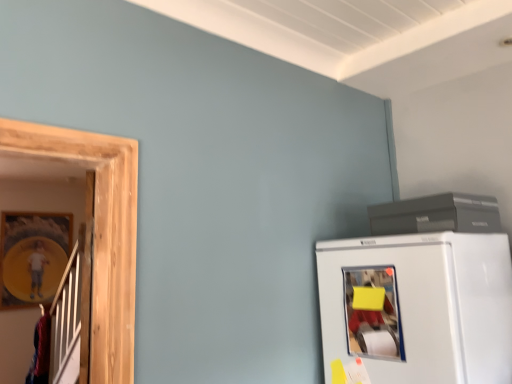
Question: Does white matte refrigerator at lower right have a lesser width compared to yellow matte paper at lower right?

Choices:
 (A) no
 (B) yes

Answer: (A)

Question: Considering the relative sizes of white matte refrigerator at lower right and yellow matte paper at lower right in the image provided, is white matte refrigerator at lower right shorter than yellow matte paper at lower right?

Choices:
 (A) no
 (B) yes

Answer: (A)

Question: From a real-world perspective, is white matte refrigerator at lower right under yellow matte paper at lower right?

Choices:
 (A) yes
 (B) no

Answer: (A)

Question: Can you confirm if white matte refrigerator at lower right is taller than yellow matte paper at lower right?

Choices:
 (A) yes
 (B) no

Answer: (A)

Question: Is white matte refrigerator at lower right aimed at yellow matte paper at lower right?

Choices:
 (A) yes
 (B) no

Answer: (A)

Question: Is point (373, 261) closer or farther from the camera than point (66, 213)?

Choices:
 (A) farther
 (B) closer

Answer: (B)

Question: Is white matte refrigerator at lower right inside or outside of wooden framed picture at left?

Choices:
 (A) inside
 (B) outside

Answer: (B)

Question: From a real-world perspective, is white matte refrigerator at lower right above or below wooden framed picture at left?

Choices:
 (A) above
 (B) below

Answer: (B)

Question: Is white matte refrigerator at lower right in front of or behind wooden framed picture at left in the image?

Choices:
 (A) front
 (B) behind

Answer: (A)

Question: Is white matte refrigerator at lower right situated inside matte gray printer at upper right or outside?

Choices:
 (A) outside
 (B) inside

Answer: (A)

Question: Considering the relative positions of white matte refrigerator at lower right and matte gray printer at upper right in the image provided, is white matte refrigerator at lower right to the left or to the right of matte gray printer at upper right?

Choices:
 (A) right
 (B) left

Answer: (B)

Question: Is white matte refrigerator at lower right taller or shorter than matte gray printer at upper right?

Choices:
 (A) short
 (B) tall

Answer: (B)

Question: From the image's perspective, is white matte refrigerator at lower right positioned above or below matte gray printer at upper right?

Choices:
 (A) below
 (B) above

Answer: (A)

Question: Looking at their shapes, would you say wooden framed picture at left is wider or thinner than yellow matte paper at lower right?

Choices:
 (A) thin
 (B) wide

Answer: (A)

Question: Based on their sizes in the image, would you say wooden framed picture at left is bigger or smaller than yellow matte paper at lower right?

Choices:
 (A) big
 (B) small

Answer: (A)